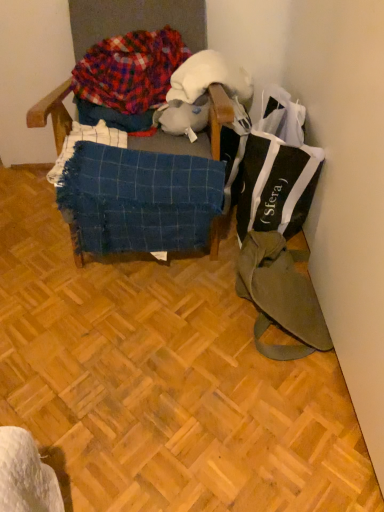
Where is `vacant space underneath blue woven blanket at center (from a real-world perspective)`? This screenshot has height=512, width=384. vacant space underneath blue woven blanket at center (from a real-world perspective) is located at coordinates (156, 274).